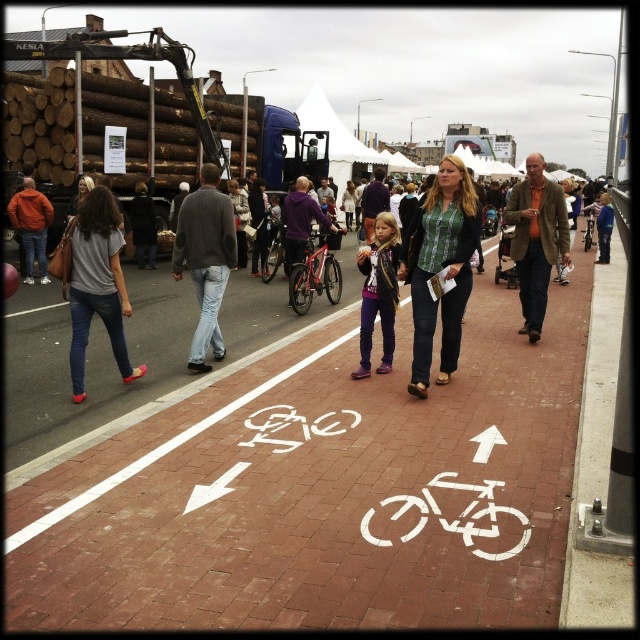
Is brick pavement at center thinner than matte purple jacket at center?

No.

Who is taller, brick pavement at center or matte purple jacket at center?

With more height is matte purple jacket at center.

Is point (502, 545) farther from viewer compared to point (365, 372)?

No, (502, 545) is closer to viewer.

I want to click on brick pavement at center, so click(323, 493).

Between point (99, 236) and point (369, 342), which one is positioned behind?

The point (369, 342) is behind.

Does denim jeans at left have a greater width compared to matte purple jacket at center?

Yes.

Is point (99, 314) positioned before point (369, 340)?

No, (99, 314) is further to viewer.

What are the coordinates of `denim jeans at left` in the screenshot? It's located at (97, 284).

Is brick pavement at center positioned before gray wool sweater at center?

Yes, it is.

Can you confirm if brick pavement at center is bigger than gray wool sweater at center?

No, brick pavement at center is not bigger than gray wool sweater at center.

Between point (390, 570) and point (234, 257), which one is positioned behind?

The point (234, 257) is more distant.

The width and height of the screenshot is (640, 640). Find the location of `brick pavement at center`. brick pavement at center is located at coordinates (323, 493).